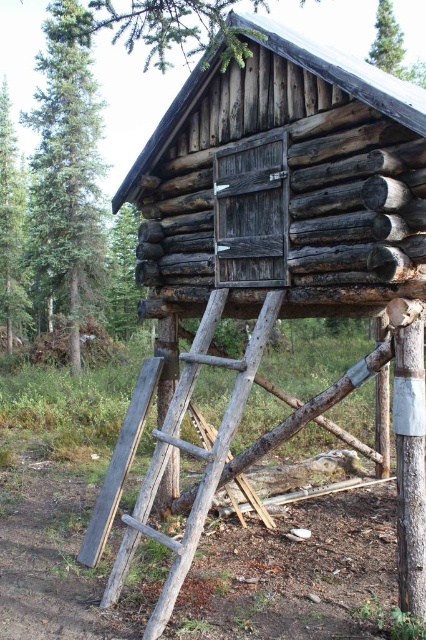
Question: Which object is farther from the camera taking this photo?

Choices:
 (A) green leafy tree at upper center
 (B) rustic wood ladder at center
 (C) green rough bark tree at upper left
 (D) green coniferous tree at left

Answer: (A)

Question: Is green rough bark tree at upper left further to the viewer compared to green leafy tree at upper center?

Choices:
 (A) no
 (B) yes

Answer: (A)

Question: Is green rough bark tree at upper left behind green leafy tree at upper center?

Choices:
 (A) yes
 (B) no

Answer: (B)

Question: Which object appears farthest from the camera in this image?

Choices:
 (A) green rough bark tree at upper left
 (B) rustic wood ladder at center
 (C) green coniferous tree at left

Answer: (A)

Question: Can you confirm if green rough bark tree at left is positioned below green leafy tree at upper center?

Choices:
 (A) no
 (B) yes

Answer: (B)

Question: Which object appears farthest from the camera in this image?

Choices:
 (A) green coniferous tree at left
 (B) green rough bark tree at upper left
 (C) green rough bark tree at left
 (D) green leafy tree at upper center

Answer: (C)